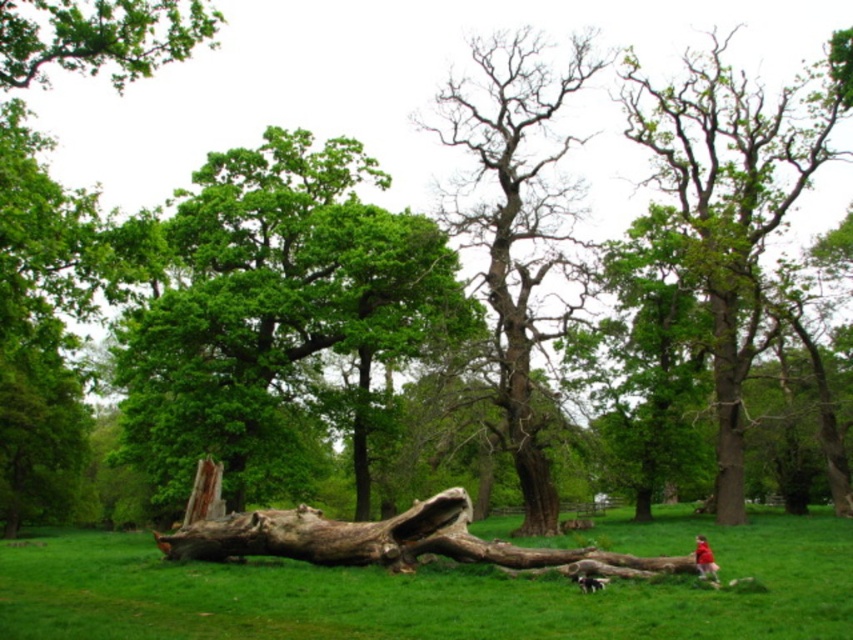
From the picture: You are standing in the park and want to take a photo of the green leafy tree at center. If your camera has a maximum zoom range of 80 feet, will you need to move closer to capture the tree in focus?

The green leafy tree at center is 90.82 feet away from you, which exceeds the camera maximum zoom range of 80 feet. You will need to move closer to capture the tree in focus.

You are a park ranger assessing the health of the trees in the image. You notice the smooth bark log at center and the bare wood tree at center. Which of these two has a greater width?

The smooth bark log at center has a larger width than the bare wood tree at center according to the description provided.

In the scene shown: You are standing in the park and see two points marked in the image. Which point is closer to you, point (x=204, y=445) or point (x=688, y=618)?

Point (x=204, y=445) is closer to you because it is further to the viewer than point (x=688, y=618).